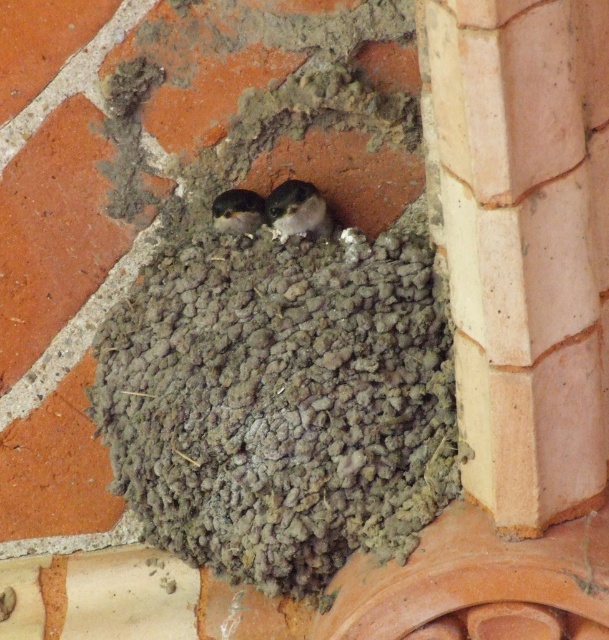
Question: Estimate the real-world distances between objects in this image. Which object is closer to the white fluffy bird at center?

Choices:
 (A) pink clay pillar at upper right
 (B) dark gray feathers at center

Answer: (B)

Question: Which point is closer to the camera?

Choices:
 (A) (214, 205)
 (B) (270, 196)
 (C) (465, 348)

Answer: (C)

Question: Is pink clay pillar at upper right wider than dark gray feathers at center?

Choices:
 (A) no
 (B) yes

Answer: (B)

Question: Which point is farther from the camera taking this photo?

Choices:
 (A) pos(250,204)
 (B) pos(290,214)
 (C) pos(477,387)

Answer: (A)

Question: Does white fluffy bird at center have a greater width compared to dark gray feathers at center?

Choices:
 (A) no
 (B) yes

Answer: (B)

Question: Can you confirm if white fluffy bird at center is positioned above dark gray feathers at center?

Choices:
 (A) no
 (B) yes

Answer: (A)